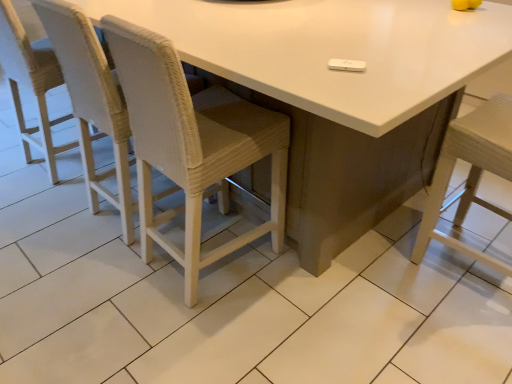
Question: From a real-world perspective, is woven fabric chair at left, the first chair in the left-to-right sequence, physically above woven white chair at left, which is the 2th chair from left to right?

Choices:
 (A) no
 (B) yes

Answer: (A)

Question: Can you confirm if woven fabric chair at left, the first chair in the left-to-right sequence, is positioned to the left of woven white chair at left, which is the 2th chair from left to right?

Choices:
 (A) no
 (B) yes

Answer: (B)

Question: Is woven fabric chair at left, the first chair in the left-to-right sequence, located outside woven white chair at left, which is the 2th chair from left to right?

Choices:
 (A) yes
 (B) no

Answer: (A)

Question: Does woven fabric chair at left, the first chair in the left-to-right sequence, turn towards woven white chair at left, which is the 2th chair from left to right?

Choices:
 (A) no
 (B) yes

Answer: (A)

Question: Is woven white chair at left, which ranks as the second chair in right-to-left order, a part of woven fabric chair at left, the first chair in the left-to-right sequence?

Choices:
 (A) no
 (B) yes

Answer: (A)

Question: Is point (34, 66) closer or farther from the camera than point (96, 18)?

Choices:
 (A) farther
 (B) closer

Answer: (A)

Question: Would you say woven fabric chair at left, the 3th chair viewed from the right, is to the left or to the right of white glossy table at center in the picture?

Choices:
 (A) right
 (B) left

Answer: (B)

Question: In the image, is woven fabric chair at left, the first chair in the left-to-right sequence, positioned in front of or behind white glossy table at center?

Choices:
 (A) behind
 (B) front

Answer: (A)

Question: From the image's perspective, is woven fabric chair at left, the first chair in the left-to-right sequence, positioned above or below white glossy table at center?

Choices:
 (A) below
 (B) above

Answer: (B)

Question: Based on their positions, is white glossy table at center located to the left or right of woven fabric chair at left, the first chair in the left-to-right sequence?

Choices:
 (A) right
 (B) left

Answer: (A)

Question: Considering their positions, is white glossy table at center located in front of or behind woven fabric chair at left, the 3th chair viewed from the right?

Choices:
 (A) front
 (B) behind

Answer: (A)

Question: Is white glossy table at center situated inside woven fabric chair at left, the 3th chair viewed from the right, or outside?

Choices:
 (A) inside
 (B) outside

Answer: (B)

Question: From the image's perspective, relative to woven fabric chair at left, the 3th chair viewed from the right, is white glossy table at center above or below?

Choices:
 (A) above
 (B) below

Answer: (B)

Question: From a real-world perspective, is woven fabric chair at left, the 3th chair viewed from the right, positioned above or below woven white chair at left, which is the 2th chair from left to right?

Choices:
 (A) below
 (B) above

Answer: (A)

Question: Is woven fabric chair at left, the first chair in the left-to-right sequence, inside or outside of woven white chair at left, which ranks as the second chair in right-to-left order?

Choices:
 (A) outside
 (B) inside

Answer: (A)